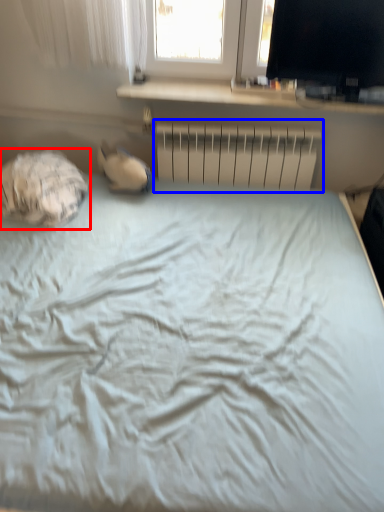
Question: Among these objects, which one is farthest to the camera, sleeping bag (highlighted by a red box) or radiator (highlighted by a blue box)?

Choices:
 (A) sleeping bag
 (B) radiator

Answer: (B)